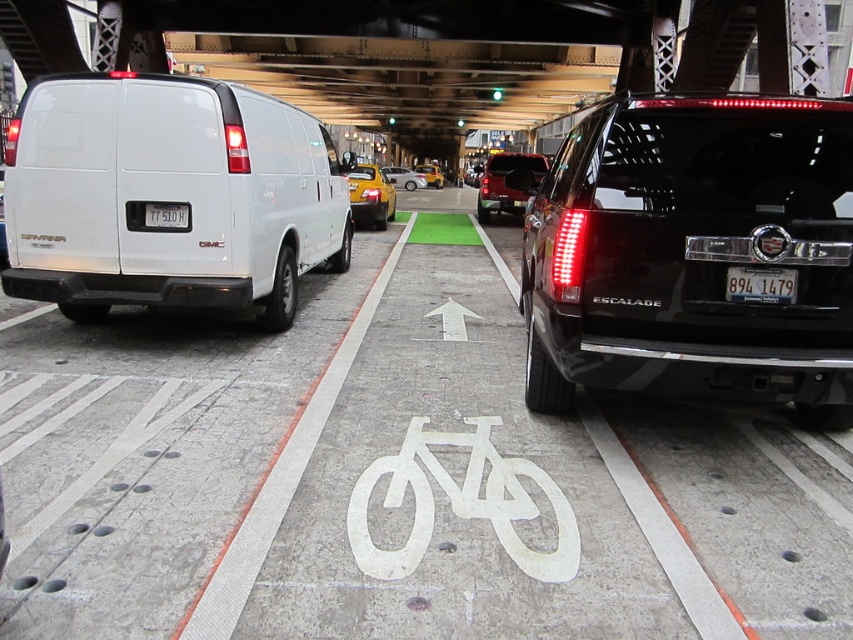
Question: Is matte black suv at center below metallic silver sedan at center?

Choices:
 (A) no
 (B) yes

Answer: (B)

Question: Which is nearer to the white plastic license plate at center-right?

Choices:
 (A) black glossy suv at right
 (B) white painted bicycle at center
 (C) white matte van at left
 (D) black plastic license plate at center

Answer: (A)

Question: Which object is positioned closest to the white painted bicycle at center?

Choices:
 (A) yellow matte taxi at center
 (B) black glossy suv at right

Answer: (B)

Question: Does white matte van at left have a lesser width compared to yellow matte taxi at center?

Choices:
 (A) yes
 (B) no

Answer: (B)

Question: Among these objects, which one is nearest to the camera?

Choices:
 (A) black glossy suv at right
 (B) yellow matte taxi cab at center
 (C) metallic silver sedan at center

Answer: (A)

Question: Is black glossy suv at right smaller than yellow matte taxi cab at center?

Choices:
 (A) yes
 (B) no

Answer: (A)